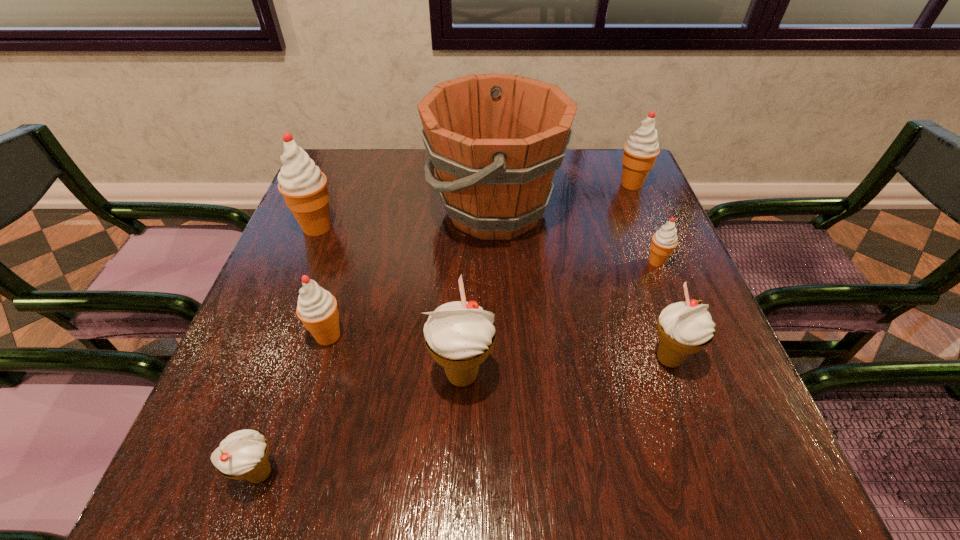
Find the location of a particular element. This screenshot has width=960, height=540. bucket is located at coordinates (495, 140).

At what (x,y) coordinates should I click in order to perform the action: click on the tallest icecream. Please return your answer as a coordinate pair (x, y). The image size is (960, 540). Looking at the image, I should click on (304, 187).

Image resolution: width=960 pixels, height=540 pixels. What are the coordinates of `the third nearest red icecream` in the screenshot? It's located at (304, 187).

Identify the location of the third smallest red icecream. (640, 151).

Identify the location of the farthest red icecream. (640, 151).

The height and width of the screenshot is (540, 960). Identify the location of the fourth icecream from left to right. (459, 335).

Identify the location of the biggest white icecream. (459, 335).

You are a GUI agent. You are given a task and a screenshot of the screen. Output one action in this format:
    pyautogui.click(x=<x>, y=<y>)
    Task: Click on the second red icecream from left to right
    This screenshot has height=540, width=960.
    Given the screenshot: What is the action you would take?
    pyautogui.click(x=317, y=308)

Image resolution: width=960 pixels, height=540 pixels. Find the location of `the nearest red icecream`. the nearest red icecream is located at coordinates (317, 308).

This screenshot has width=960, height=540. Find the location of `the rightmost white icecream`. the rightmost white icecream is located at coordinates (684, 328).